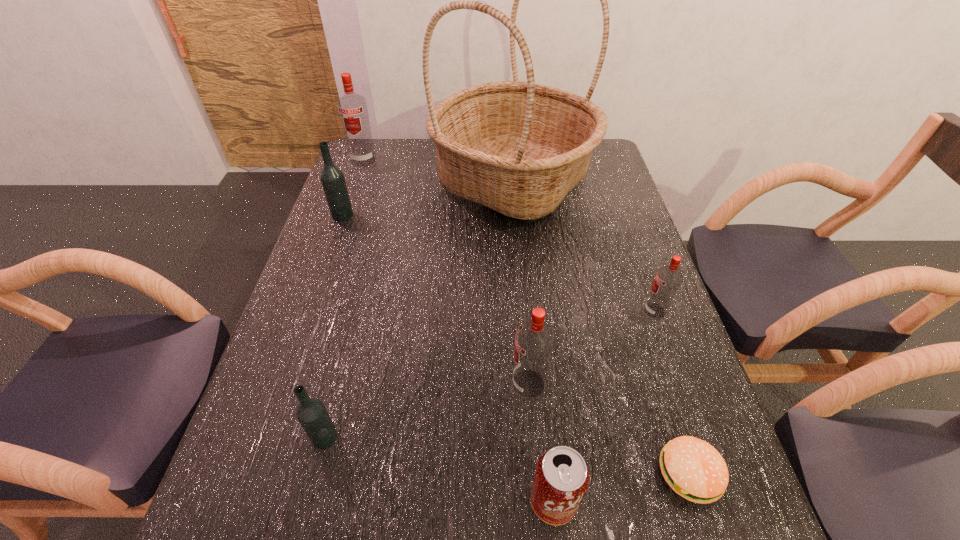
Locate an element on the screen. basket is located at coordinates (519, 148).

Locate an element on the screen. This screenshot has width=960, height=540. the leftmost red vodka is located at coordinates (352, 108).

In order to click on the farthest red vodka in this screenshot , I will do `click(352, 108)`.

The width and height of the screenshot is (960, 540). In order to click on the fourth nearest vodka in this screenshot , I will do `click(332, 178)`.

This screenshot has width=960, height=540. I want to click on the farther black vodka, so click(332, 178).

The image size is (960, 540). Identify the location of the second red vodka from right to left. (534, 340).

The width and height of the screenshot is (960, 540). Identify the location of the fourth vodka from left to right. (x=534, y=340).

Locate an element on the screen. the third farthest vodka is located at coordinates (668, 278).

Identify the location of the rightmost red vodka. (668, 278).

Locate an element on the screen. Image resolution: width=960 pixels, height=540 pixels. the nearest vodka is located at coordinates (311, 413).